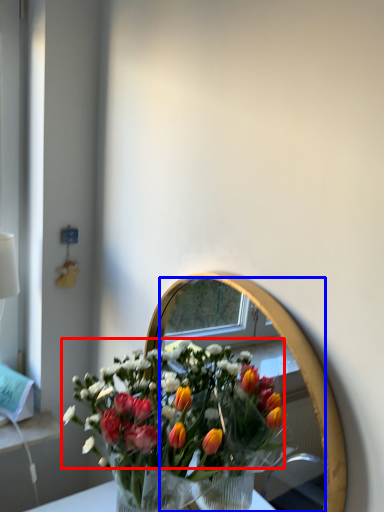
Question: Which point is closer to the camera, flower (highlighted by a red box) or mirror (highlighted by a blue box)?

Choices:
 (A) flower
 (B) mirror

Answer: (B)